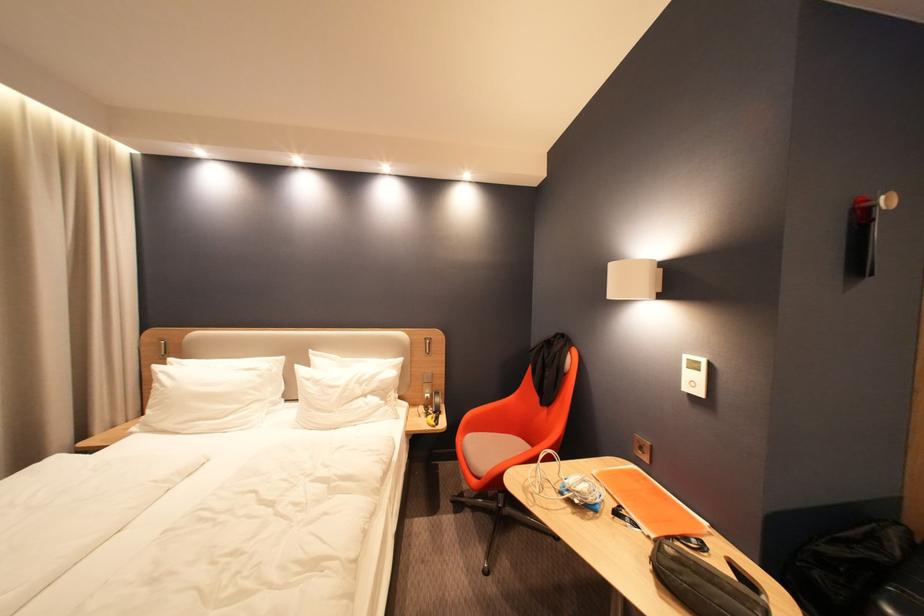
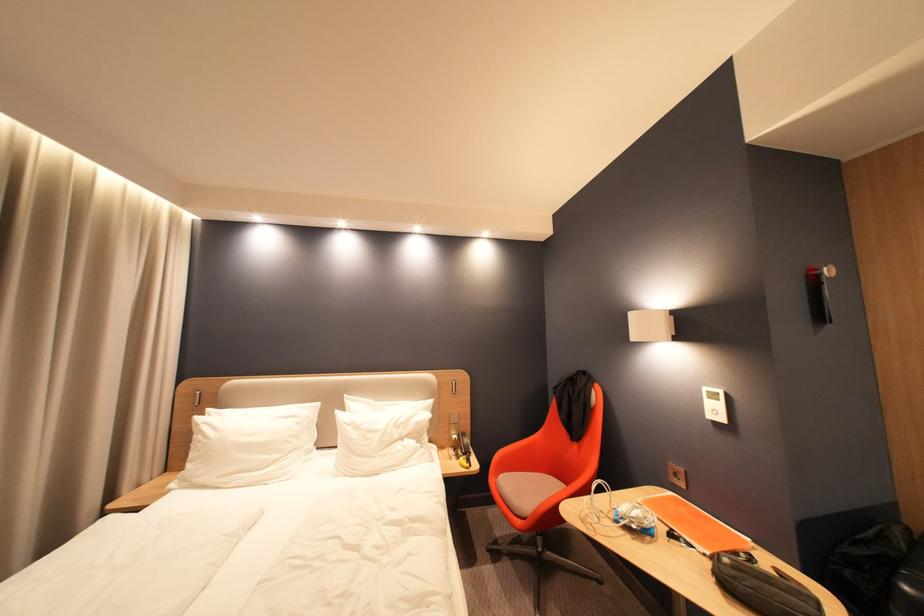
Find the pixel in the second image that matches (x=888, y=200) in the first image.

(830, 270)